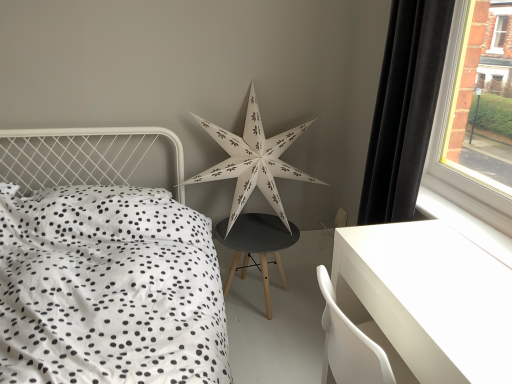
Question: In the image, is black velvet curtain at right positioned in front of or behind white paper star at center?

Choices:
 (A) behind
 (B) front

Answer: (B)

Question: In terms of width, does black velvet curtain at right look wider or thinner when compared to white paper star at center?

Choices:
 (A) thin
 (B) wide

Answer: (A)

Question: Which object is positioned closest to the white glossy table at lower right?

Choices:
 (A) white dotted fabric at left
 (B) white paper star at center
 (C) black matte stool at center
 (D) black velvet curtain at right
 (E) white smooth window sill at lower right

Answer: (E)

Question: Based on their relative distances, which object is nearer to the black matte stool at center?

Choices:
 (A) white dotted fabric at left
 (B) white smooth window sill at lower right
 (C) white glossy table at lower right
 (D) white paper star at center
 (E) black velvet curtain at right

Answer: (D)